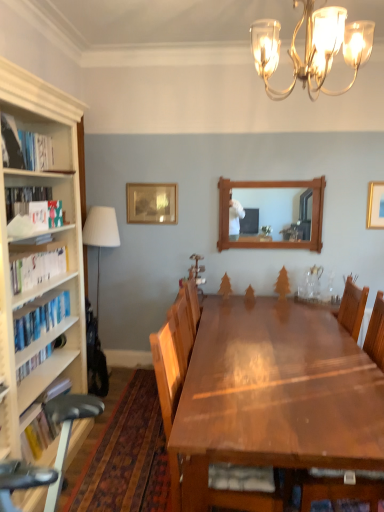
I want to click on white paperbacks at left, the third book from the top, so click(x=37, y=269).

At what (x,y) coordinates should I click in order to perform the action: click on hardcover book at left, the 5th book positioned from the top. Please return your answer as a coordinate pair (x, y). Looking at the image, I should click on (34, 361).

How much space does gold metallic picture frame at upper right, the second picture frame when ordered from back to front, occupy vertically?

It is 16.16 inches.

Measure the distance between point [91,211] and camera.

Point [91,211] and camera are 3.67 meters apart.

Identify the location of white fabric lampshade at left. (100, 234).

What are the coordinates of `white paperbacks at left, the third book from the top` in the screenshot? It's located at (x=37, y=269).

Would you say wooden picture frame at upper center, which is the first picture frame from left to right, is a long distance from hardcover book at left, which appears as the fourth book when ordered from the bottom?

Yes, wooden picture frame at upper center, which is the first picture frame from left to right, and hardcover book at left, which appears as the fourth book when ordered from the bottom, are located far from each other.

Is wooden picture frame at upper center, the first picture frame in the back-to-front sequence, further to camera compared to hardcover book at left, which appears as the fourth book when ordered from the bottom?

Yes, wooden picture frame at upper center, the first picture frame in the back-to-front sequence, is further from the camera.

From a real-world perspective, is wooden picture frame at upper center, arranged as the 2th picture frame when viewed from the right, above or below hardcover book at left, which appears as the fourth book when ordered from the bottom?

wooden picture frame at upper center, arranged as the 2th picture frame when viewed from the right, is below hardcover book at left, which appears as the fourth book when ordered from the bottom.

Image resolution: width=384 pixels, height=512 pixels. What are the coordinates of `the 1st book below the wooden picture frame at upper center, the first picture frame in the back-to-front sequence (from the image's perspective)` in the screenshot? It's located at (34, 205).

From the image's perspective, is hardcover book at left, the 2th book when ordered from top to bottom, positioned above or below hardcover book at left, the 1th book from the bottom?

From the image's perspective, hardcover book at left, the 2th book when ordered from top to bottom, appears above hardcover book at left, the 1th book from the bottom.

From a real-world perspective, between hardcover book at left, which appears as the fourth book when ordered from the bottom, and hardcover book at left, the 5th book positioned from the top, who is vertically higher?

From a 3D spatial view, hardcover book at left, which appears as the fourth book when ordered from the bottom, is above.

Is point (40, 214) in front of point (49, 351)?

That is True.

Is hardcover book at left, the 2th book when ordered from top to bottom, smaller than hardcover book at left, the 1th book from the bottom?

Actually, hardcover book at left, the 2th book when ordered from top to bottom, might be larger than hardcover book at left, the 1th book from the bottom.

Would you say wooden frame mirror at center is outside hardcover book at left, which appears as the fourth book when ordered from the bottom?

Yes, wooden frame mirror at center is outside of hardcover book at left, which appears as the fourth book when ordered from the bottom.

From the image's perspective, is wooden frame mirror at center under hardcover book at left, the 2th book when ordered from top to bottom?

No.

Which point is more forward, (262, 200) or (20, 202)?

The point (20, 202) is closer.

How different are the orientations of wooden frame mirror at center and hardcover book at left, which appears as the fourth book when ordered from the bottom, in degrees?

wooden frame mirror at center and hardcover book at left, which appears as the fourth book when ordered from the bottom, are facing 91.8 degrees away from each other.

Considering their positions, is hardcover book at left, the 2th book when ordered from top to bottom, located in front of or behind hardcover books at left, which is counted as the 4th book, starting from the top?

hardcover book at left, the 2th book when ordered from top to bottom, is behind hardcover books at left, which is counted as the 4th book, starting from the top.

Choose the correct answer: Is hardcover book at left, which appears as the fourth book when ordered from the bottom, inside hardcover books at left, which is counted as the 4th book, starting from the top, or outside it?

hardcover book at left, which appears as the fourth book when ordered from the bottom, exists outside the volume of hardcover books at left, which is counted as the 4th book, starting from the top.

Is point (34, 223) closer or farther from the camera than point (57, 317)?

Point (34, 223).

From the image's perspective, is white fabric lampshade at left located above hardcover books at left, which is counted as the 4th book, starting from the top?

Yes, from the image's perspective, white fabric lampshade at left is over hardcover books at left, which is counted as the 4th book, starting from the top.

Looking at this image, is hardcover books at left, the second book positioned from the bottom, located within white fabric lampshade at left?

No, hardcover books at left, the second book positioned from the bottom, is not a part of white fabric lampshade at left.

Does white fabric lampshade at left have a greater height compared to hardcover books at left, which is counted as the 4th book, starting from the top?

Correct, white fabric lampshade at left is much taller as hardcover books at left, which is counted as the 4th book, starting from the top.

From the image's perspective, is wooden frame mirror at center positioned above or below gold metallic chandelier at upper center?

From the image's perspective, wooden frame mirror at center appears below gold metallic chandelier at upper center.

Does wooden frame mirror at center touch gold metallic chandelier at upper center?

No, wooden frame mirror at center is not in contact with gold metallic chandelier at upper center.

Based on the photo, is wooden frame mirror at center oriented towards gold metallic chandelier at upper center?

Yes, wooden frame mirror at center is turned towards gold metallic chandelier at upper center.

Is wooden frame mirror at center situated inside gold metallic chandelier at upper center or outside?

wooden frame mirror at center cannot be found inside gold metallic chandelier at upper center.

Is hardcover book at left, the 2th book when ordered from top to bottom, beside shiny brown wooden table at center?

hardcover book at left, the 2th book when ordered from top to bottom, and shiny brown wooden table at center are clearly separated.

Which of these two, hardcover book at left, which appears as the fourth book when ordered from the bottom, or shiny brown wooden table at center, is thinner?

Thinner between the two is hardcover book at left, which appears as the fourth book when ordered from the bottom.

How different are the orientations of hardcover book at left, which appears as the fourth book when ordered from the bottom, and shiny brown wooden table at center in degrees?

The facing directions of hardcover book at left, which appears as the fourth book when ordered from the bottom, and shiny brown wooden table at center are 92.3 degrees apart.

Could you measure the distance between hardcover book at left, the 2th book when ordered from top to bottom, and shiny brown wooden table at center?

The distance of hardcover book at left, the 2th book when ordered from top to bottom, from shiny brown wooden table at center is 1.47 meters.

At what (x,y) coordinates should I click in order to perform the action: click on the 3rd book counting from the left of the wooden picture frame at upper center, which is the first picture frame from left to right. Please return your answer as a coordinate pair (x, y). Looking at the image, I should click on (34, 205).

From a real-world perspective, count 3rd books upward from the hardcover book at left, the 5th book positioned from the top, and point to it. Please provide its 2D coordinates.

[(34, 205)]

Estimate the real-world distances between objects in this image. Which object is further from shiny brown wooden table at center, hardcover book at left, which appears as the fourth book when ordered from the bottom, or wooden picture frame at upper center, which appears as the 2th picture frame when viewed from the front?

wooden picture frame at upper center, which appears as the 2th picture frame when viewed from the front, lies further to shiny brown wooden table at center than the other object.

When comparing their distances from hardcover books at left, the second book positioned from the bottom, does shiny brown wooden table at center or wooden chair at center seem closer?

shiny brown wooden table at center is positioned closer to the anchor hardcover books at left, the second book positioned from the bottom.

Looking at the image, which one is located further to wooden chair at center, white paperbacks at left, which appears as the 3th book when ordered from the bottom, or hardcover book at left, which appears as the fourth book when ordered from the bottom?

hardcover book at left, which appears as the fourth book when ordered from the bottom, is further to wooden chair at center.

Looking at the image, which one is located further to hardcover book at left, the 2th book when ordered from top to bottom, wooden chair at center or hardcover book at left, the 5th book positioned from the top?

wooden chair at center is positioned further to the anchor hardcover book at left, the 2th book when ordered from top to bottom.

Considering their positions, is hardcover books at left, which is counted as the 4th book, starting from the top, positioned further to hardcover book at left, the 1th book from the bottom, than wooden picture frame at upper center, which appears as the 2th picture frame when viewed from the front?

Among the two, wooden picture frame at upper center, which appears as the 2th picture frame when viewed from the front, is located further to hardcover book at left, the 1th book from the bottom.

Which object lies nearer to the anchor point wooden picture frame at upper center, arranged as the 2th picture frame when viewed from the right, white paperbacks at left, which appears as the 3th book when ordered from the bottom, or gold metallic picture frame at upper right, which is the second picture frame from left to right?

white paperbacks at left, which appears as the 3th book when ordered from the bottom, lies closer to wooden picture frame at upper center, arranged as the 2th picture frame when viewed from the right, than the other object.

Estimate the real-world distances between objects in this image. Which object is closer to wooden picture frame at upper center, which is the first picture frame from left to right, white paperbacks at left, which appears as the 3th book when ordered from the bottom, or white fabric lampshade at left?

white fabric lampshade at left is positioned closer to the anchor wooden picture frame at upper center, which is the first picture frame from left to right.

Looking at the image, which one is located closer to gold metallic chandelier at upper center, white paperbacks at left, the third book from the top, or hardcover books at left, which is counted as the 4th book, starting from the top?

white paperbacks at left, the third book from the top.

This screenshot has width=384, height=512. I want to click on mirror located between gold metallic chandelier at upper center and wooden picture frame at upper center, the first picture frame in the back-to-front sequence, in the depth direction, so click(x=271, y=205).

Identify the location of lamp located between white paperbacks at left, which appears as the 3th book when ordered from the bottom, and wooden chair at center in the depth direction. (100, 234).

The height and width of the screenshot is (512, 384). I want to click on book between hardcover book at left, which is the fifth book in bottom-to-top order, and white paperbacks at left, which appears as the 3th book when ordered from the bottom, from top to bottom, so click(34, 205).

I want to click on mirror between wooden chair at center and gold metallic picture frame at upper right, the first picture frame positioned from the front, so click(x=271, y=205).